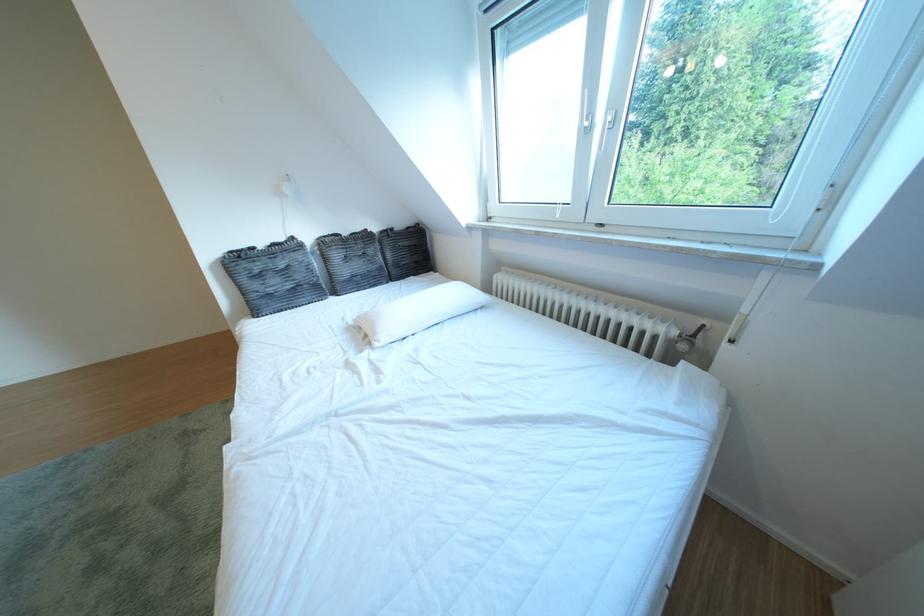
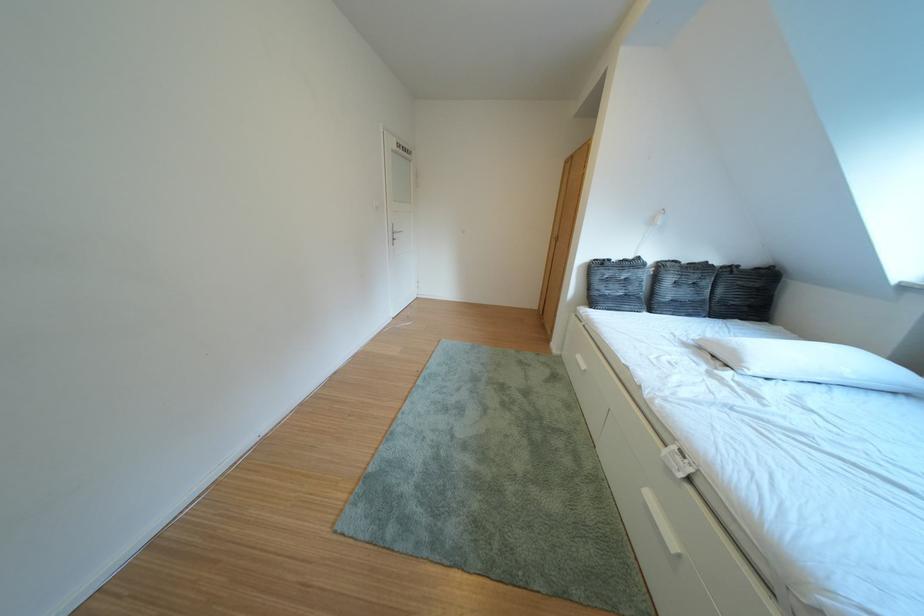
Question: The images are taken continuously from a first-person perspective. In which direction is your viewpoint rotating?

Choices:
 (A) Left
 (B) Right
 (C) Up
 (D) Down

Answer: (A)